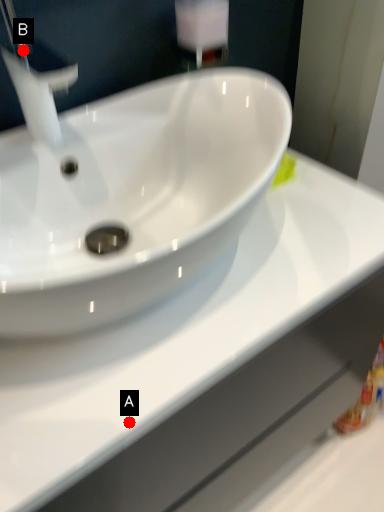
Question: Two points are circled on the image, labeled by A and B beside each circle. Which point appears farthest from the camera in this image?

Choices:
 (A) A is further
 (B) B is further

Answer: (B)